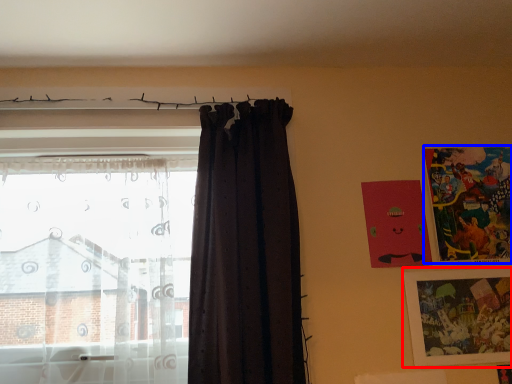
Question: Among these objects, which one is farthest to the camera, picture frame (highlighted by a red box) or picture frame (highlighted by a blue box)?

Choices:
 (A) picture frame
 (B) picture frame

Answer: (B)